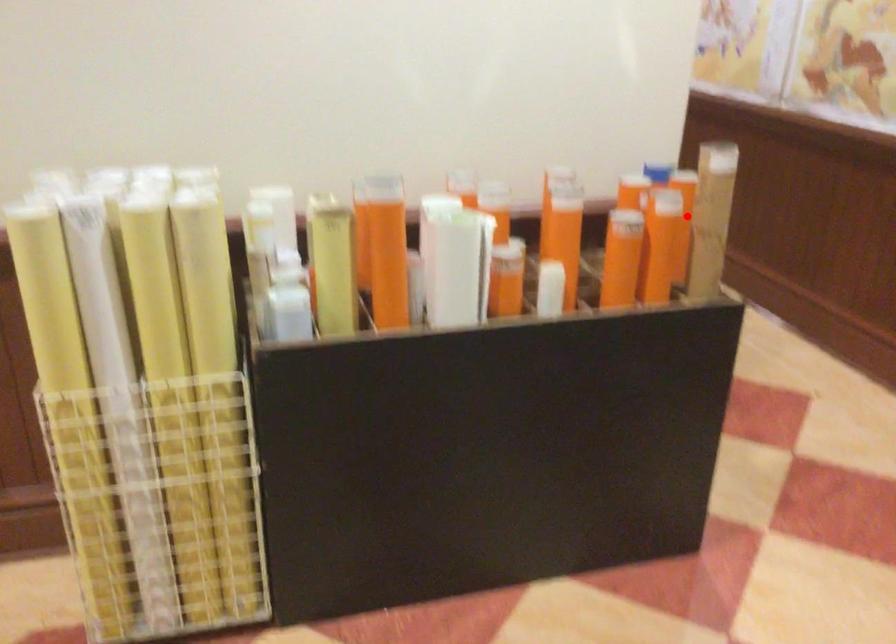
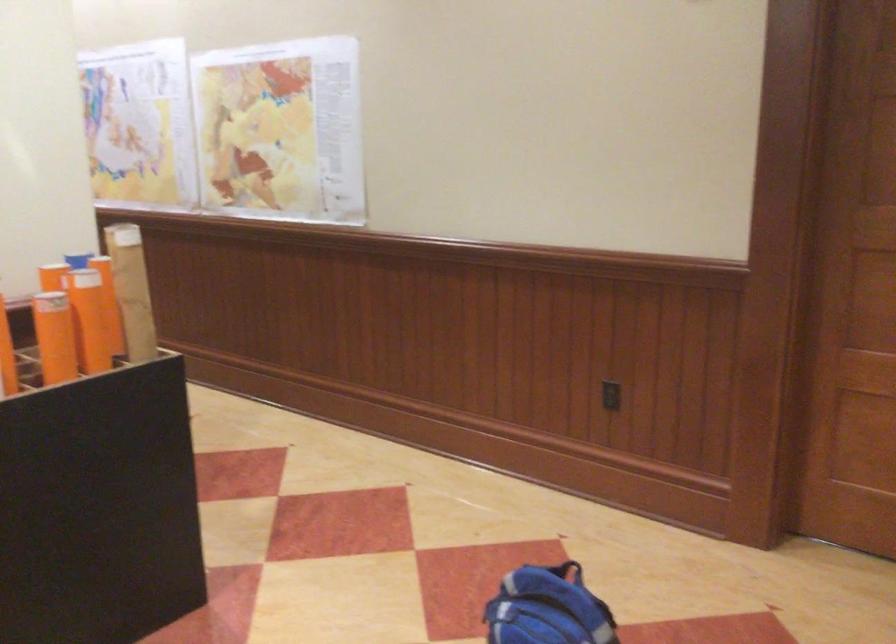
Locate, in the second image, the point that corresponds to the highlighted location in the first image.

(132, 290)